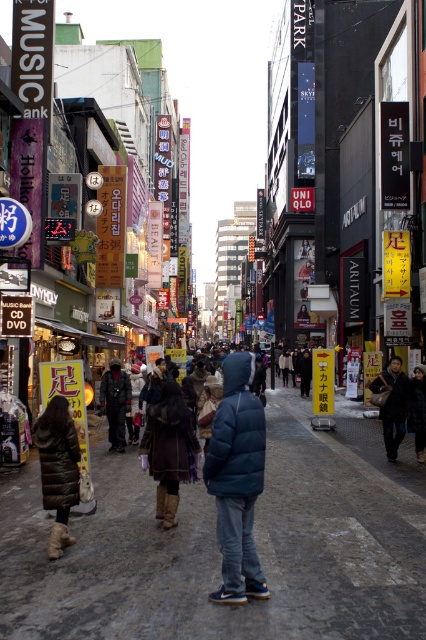
Question: Can you confirm if brown leather jacket at center is positioned below dark blue jacket at center?

Choices:
 (A) no
 (B) yes

Answer: (A)

Question: Which object is the farthest from the dark brown leather jacket at right?

Choices:
 (A) brown fur coat at lower left
 (B) dark blue jacket at center
 (C) matte blue jacket at center
 (D) teal puffer jacket at center

Answer: (A)

Question: Which of the following is the farthest from the observer?

Choices:
 (A) (253, 499)
 (B) (393, 355)
 (C) (117, 376)
 (D) (184, 460)

Answer: (B)

Question: Can you confirm if teal puffer jacket at center is positioned to the left of brown fur coat at lower left?

Choices:
 (A) yes
 (B) no

Answer: (B)

Question: Among these points, which one is nearest to the camera?

Choices:
 (A) (400, 403)
 (B) (114, 422)

Answer: (A)

Question: Is the position of brown leather jacket at center less distant than that of dark blue jacket at center?

Choices:
 (A) no
 (B) yes

Answer: (B)